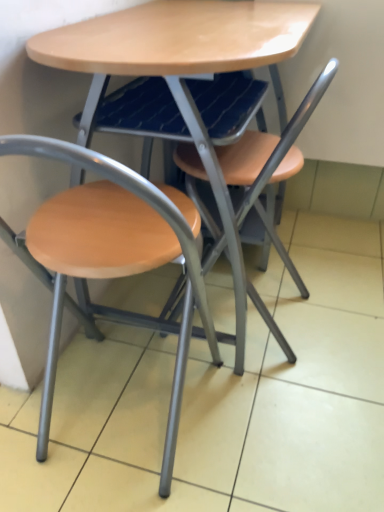
Question: Is matte wood chair at left, marked as the first chair in a left-to-right arrangement, facing towards matte wood table at center?

Choices:
 (A) no
 (B) yes

Answer: (B)

Question: Is matte wood chair at left, which is counted as the second chair, starting from the right, thinner than matte wood table at center?

Choices:
 (A) yes
 (B) no

Answer: (A)

Question: Is matte wood chair at left, marked as the first chair in a left-to-right arrangement, looking in the opposite direction of matte wood table at center?

Choices:
 (A) no
 (B) yes

Answer: (A)

Question: Does matte wood chair at left, marked as the first chair in a left-to-right arrangement, contain matte wood table at center?

Choices:
 (A) no
 (B) yes

Answer: (A)

Question: Is matte wood chair at left, marked as the first chair in a left-to-right arrangement, positioned in front of matte wood table at center?

Choices:
 (A) no
 (B) yes

Answer: (B)

Question: Is matte wood chair at left, which is counted as the second chair, starting from the right, outside of matte wood table at center?

Choices:
 (A) yes
 (B) no

Answer: (B)

Question: Is matte wood chair at left, which is counted as the second chair, starting from the right, positioned beyond the bounds of wooden seat at center, positioned as the first chair in right-to-left order?

Choices:
 (A) yes
 (B) no

Answer: (A)

Question: Does matte wood chair at left, which is counted as the second chair, starting from the right, contain wooden seat at center, positioned as the first chair in right-to-left order?

Choices:
 (A) no
 (B) yes

Answer: (A)

Question: From a real-world perspective, is matte wood chair at left, which is counted as the second chair, starting from the right, positioned under wooden seat at center, acting as the second chair starting from the left, based on gravity?

Choices:
 (A) no
 (B) yes

Answer: (B)

Question: Is matte wood chair at left, marked as the first chair in a left-to-right arrangement, shorter than wooden seat at center, acting as the second chair starting from the left?

Choices:
 (A) no
 (B) yes

Answer: (B)

Question: Does matte wood chair at left, marked as the first chair in a left-to-right arrangement, appear on the left side of wooden seat at center, positioned as the first chair in right-to-left order?

Choices:
 (A) no
 (B) yes

Answer: (B)

Question: Does matte wood chair at left, marked as the first chair in a left-to-right arrangement, lie in front of wooden seat at center, acting as the second chair starting from the left?

Choices:
 (A) no
 (B) yes

Answer: (B)

Question: From a real-world perspective, does matte wood table at center sit lower than wooden seat at center, acting as the second chair starting from the left?

Choices:
 (A) yes
 (B) no

Answer: (B)